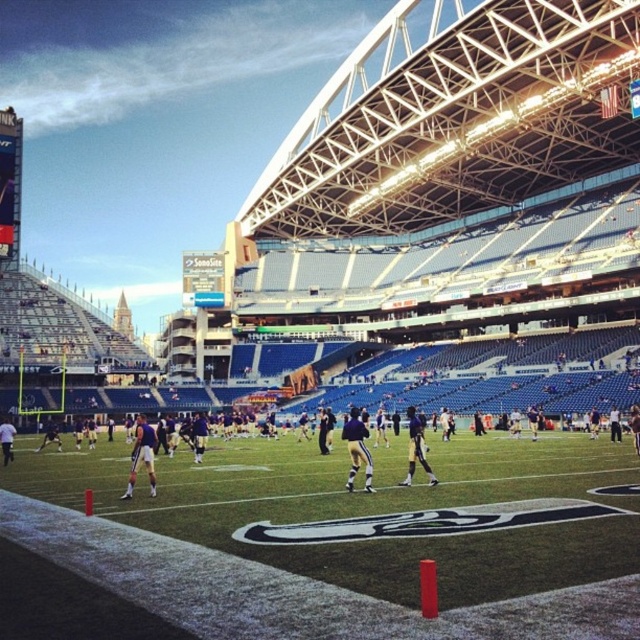
You are a photographer positioned at the edge of the field. You want to take a photo that includes both the green artificial turf at lower left and the gold metallic uniform at center. Which object should you focus on first to ensure both are in sharp focus?

The green artificial turf at lower left is closer to the viewer than the gold metallic uniform at center. To ensure both are in sharp focus, focus on the green artificial turf at lower left first because it is closer, and the depth of field will extend to the gold metallic uniform at center.

In the scene shown: You are a photographer standing at the center of the field in the stadium. You want to take a photo that includes both point (148, 499) and point (490, 470). Which point will appear closer to the bottom of the photo?

Point (148, 499) is closer to the camera than point (490, 470), so in the photo, point (148, 499) will appear closer to the bottom of the photo.

You are a photographer standing at the edge of the field. You want to take a photo that includes both the green artificial turf at lower left and the gold metallic uniform at center. Based on their positions, which object should appear closer to the bottom of the photo?

The green artificial turf at lower left is positioned under the gold metallic uniform at center, so it should appear closer to the bottom of the photo.